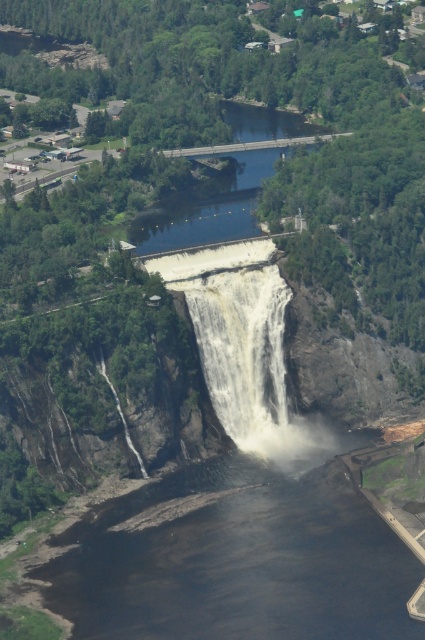
Based on the scene described, which body of water is positioned lower in the image, the dark water at lower left or the white frothy water at center?

The dark water at lower left is located below the white frothy water at center, meaning it is positioned lower in the image.

You are a drone operator trying to capture a photo of the waterfall. Your drone is currently at the center of the image. Which direction should you move the drone to get a better view of the dark water at lower left?

The dark water at lower left is located at point [235,560], so you should move the drone to the left and slightly downward to capture it better.

You are a drone operator trying to capture the waterfall from above. Your drone has a camera that can only focus on one area at a time. If you first focus on the dark water at lower left, will the clear water at center be visible in the same shot?

The dark water at lower left is in front of clear water at center, so the clear water at center will be partially or fully blocked from view if the drone focuses on the dark water at lower left. Therefore, the clear water at center may not be visible in the same shot.